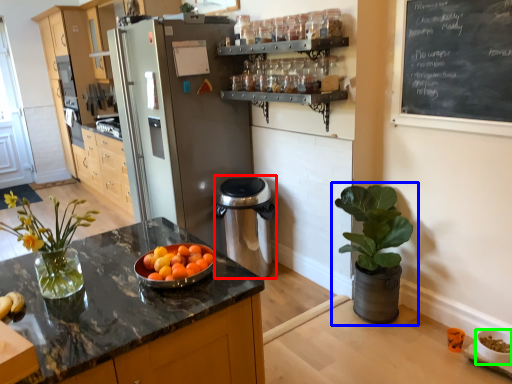
Question: Which object is positioned farthest from appliance (highlighted by a red box)? Select from houseplant (highlighted by a blue box) and glass bowl (highlighted by a green box).

Choices:
 (A) houseplant
 (B) glass bowl

Answer: (B)